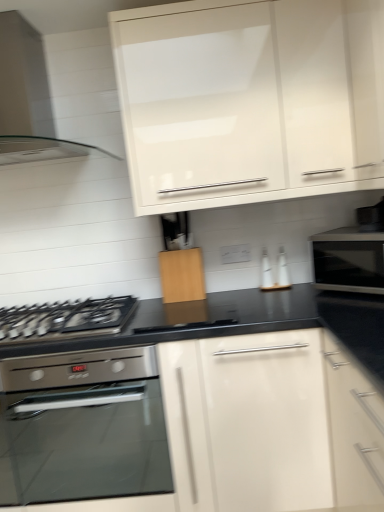
Identify the location of empty space that is ontop of black glossy microwave at right. The height and width of the screenshot is (512, 384). (358, 231).